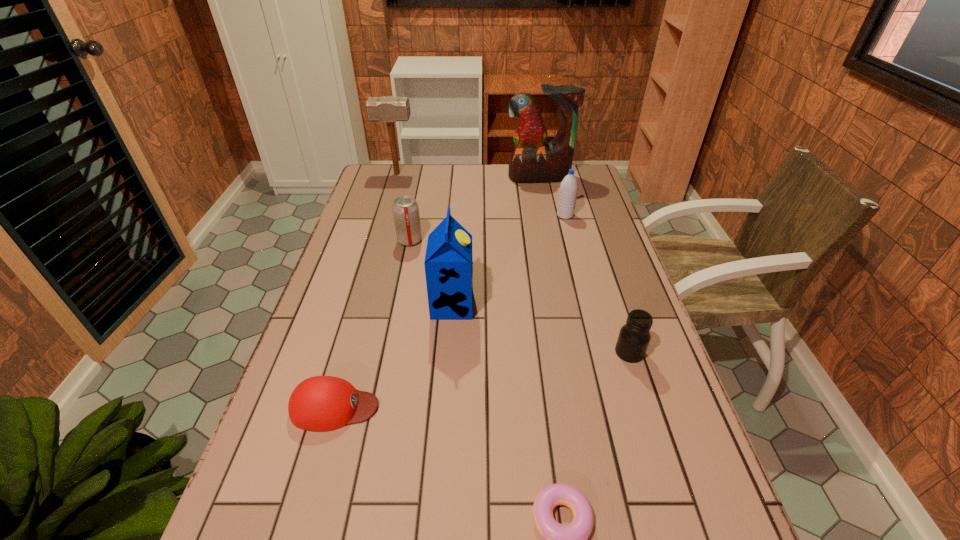
Where is `mallet situated at the far edge`? mallet situated at the far edge is located at coordinates (390, 109).

What are the coordinates of `mallet present at the left edge` in the screenshot? It's located at pos(390,109).

In order to click on baseball cap present at the left edge in this screenshot , I will do `click(321, 403)`.

Locate an element on the screen. The width and height of the screenshot is (960, 540). parrot situated at the right edge is located at coordinates (532, 161).

Identify the location of water bottle that is at the right edge. The width and height of the screenshot is (960, 540). (568, 191).

What are the coordinates of `jar present at the right edge` in the screenshot? It's located at (634, 337).

Locate an element on the screen. object positioned at the far left corner is located at coordinates (390, 109).

You are a GUI agent. You are given a task and a screenshot of the screen. Output one action in this format:
    pyautogui.click(x=<x>, y=<y>)
    Task: Click on the object present at the far right corner
    Image resolution: width=960 pixels, height=540 pixels.
    Given the screenshot: What is the action you would take?
    pyautogui.click(x=532, y=161)

Locate an element on the screen. This screenshot has height=540, width=960. vacant space at the far edge is located at coordinates (420, 180).

Image resolution: width=960 pixels, height=540 pixels. In the image, there is a desktop. Identify the location of vacant region at the left edge. (283, 484).